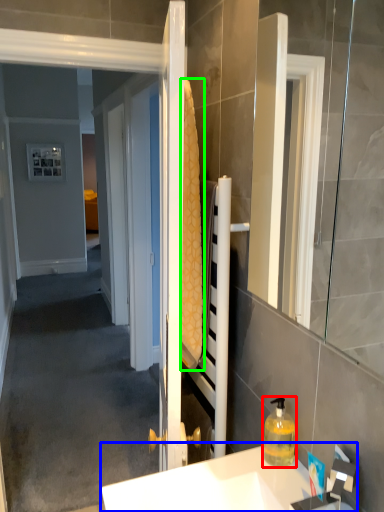
Question: Which object is the closest to the bottle (highlighted by a red box)? Choose among these: sink (highlighted by a blue box) or bath towel (highlighted by a green box).

Choices:
 (A) sink
 (B) bath towel

Answer: (A)